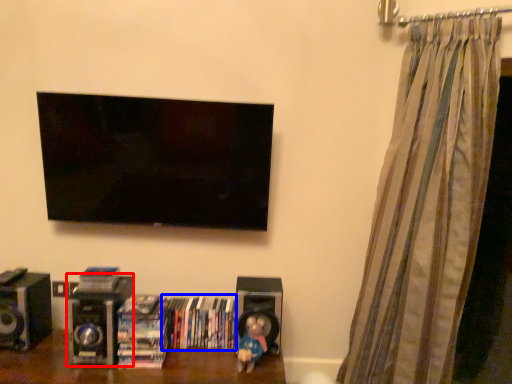
Question: Which object is closer to the camera taking this photo, speaker (highlighted by a red box) or book (highlighted by a blue box)?

Choices:
 (A) speaker
 (B) book

Answer: (A)